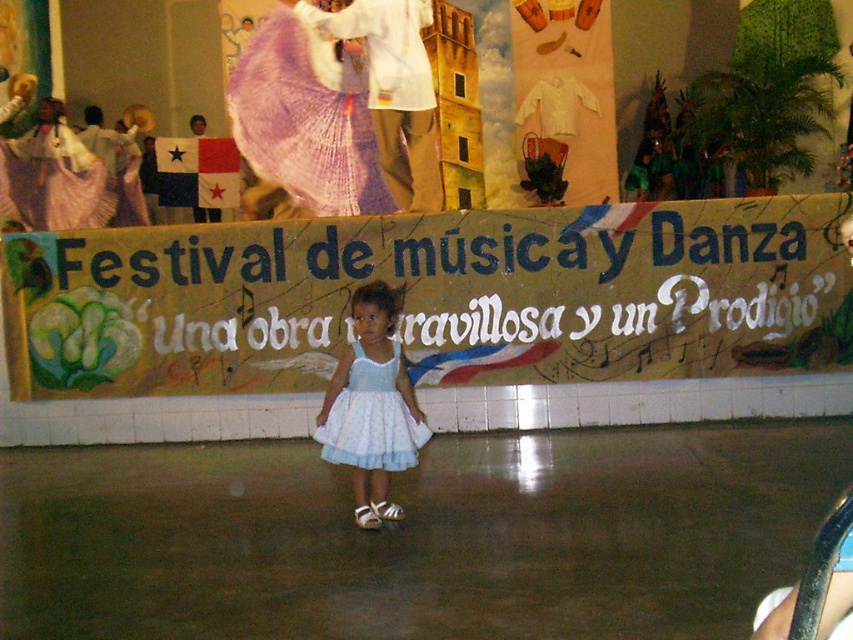
Does yellow paper banner at center have a lesser height compared to white lace dress at center?

Yes.

Can you confirm if yellow paper banner at center is thinner than white lace dress at center?

No, yellow paper banner at center is not thinner than white lace dress at center.

Where is `yellow paper banner at center`? This screenshot has height=640, width=853. yellow paper banner at center is located at coordinates (433, 298).